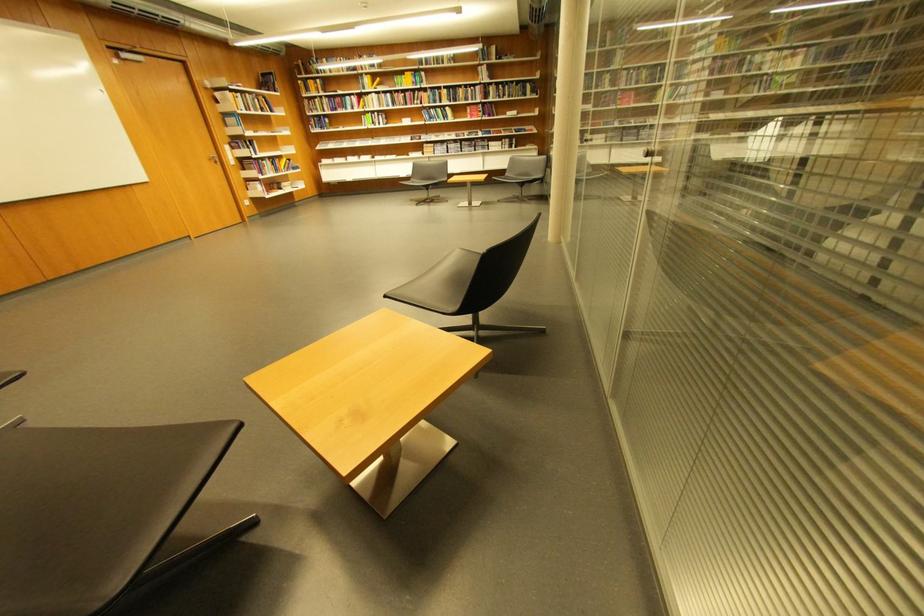
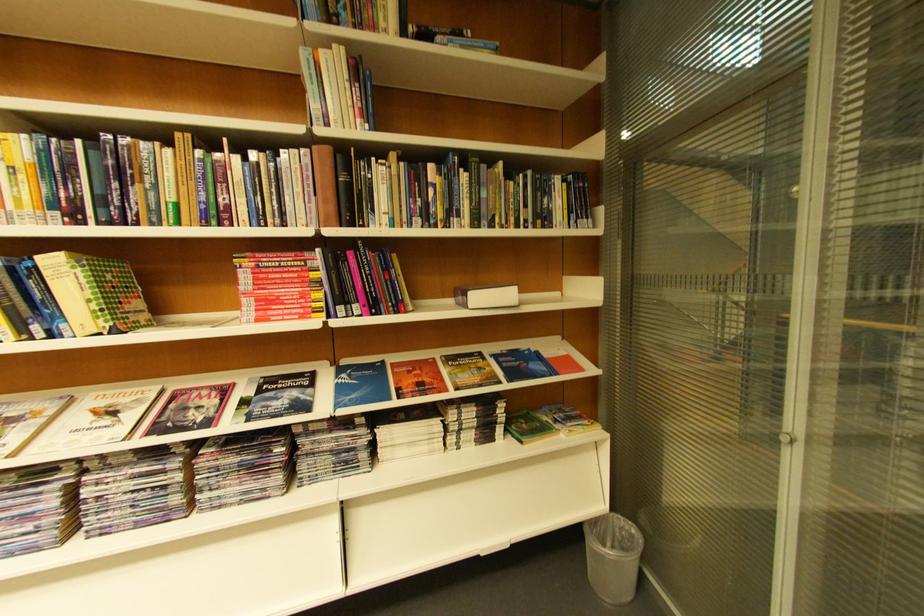
In the second image, find the point that corresponds to (492,68) in the first image.

(332, 55)